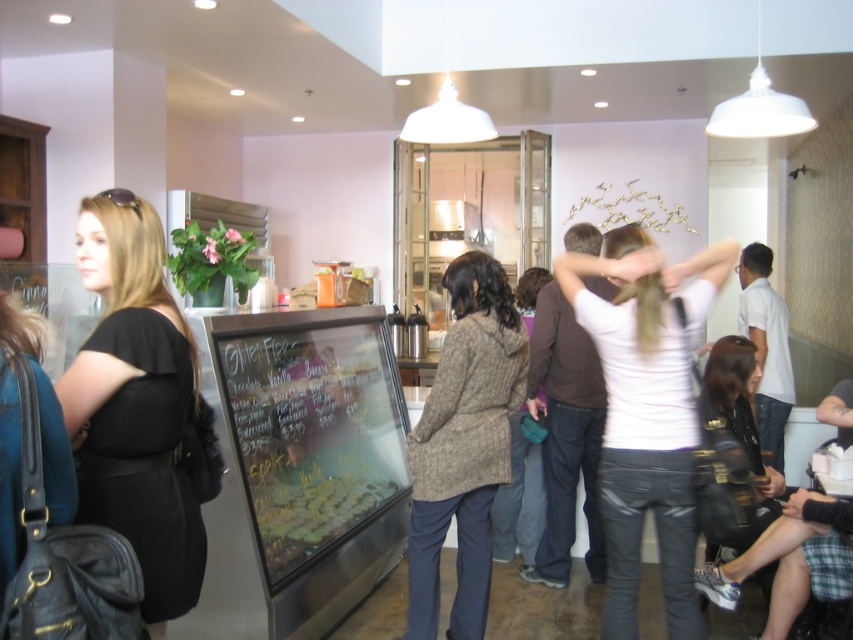
Which is in front, point (349, 465) or point (473, 413)?

Point (473, 413)

This screenshot has height=640, width=853. In order to click on black glass menu board at center in this screenshot , I will do `click(310, 428)`.

Is point (265, 515) farther from camera compared to point (463, 401)?

Yes, point (265, 515) is farther from viewer.

Find the location of a particular element. black glass menu board at center is located at coordinates coord(310,428).

Who is shorter, green matte cookies at center or leather jacket at lower right?

With less height is green matte cookies at center.

Is point (274, 547) farther from viewer compared to point (733, 362)?

No, (274, 547) is closer to viewer.

What are the coordinates of `green matte cookies at center` in the screenshot? It's located at (317, 509).

Does white matte shirt at center appear on the right side of green matte cookies at center?

Yes, white matte shirt at center is to the right of green matte cookies at center.

Who is more forward, (599, 324) or (258, 524)?

Point (599, 324)

The height and width of the screenshot is (640, 853). What are the coordinates of `white matte shirt at center` in the screenshot? It's located at (646, 413).